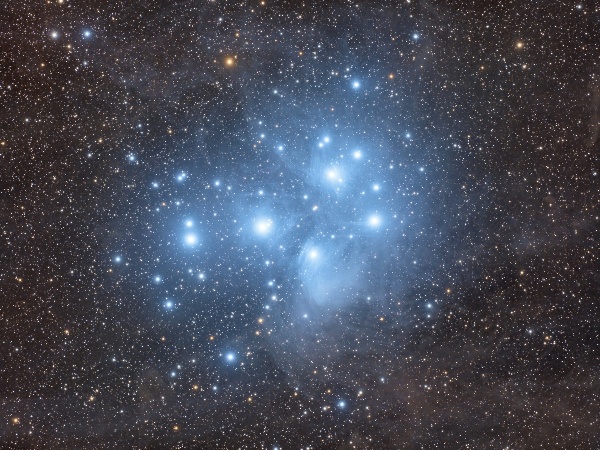
Identify the location of bright lights. This screenshot has height=450, width=600. (377, 215), (259, 230), (187, 240), (359, 155), (367, 179).